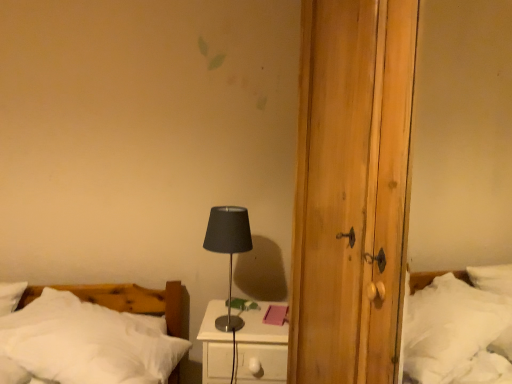
Question: Does white soft bed at lower left appear on the right side of white glossy nightstand at center?

Choices:
 (A) yes
 (B) no

Answer: (B)

Question: From the image's perspective, is white soft bed at lower left below white glossy nightstand at center?

Choices:
 (A) no
 (B) yes

Answer: (A)

Question: Is white soft bed at lower left directly adjacent to white glossy nightstand at center?

Choices:
 (A) yes
 (B) no

Answer: (B)

Question: Can you confirm if white soft bed at lower left is smaller than white glossy nightstand at center?

Choices:
 (A) yes
 (B) no

Answer: (B)

Question: Is white soft bed at lower left wider than white glossy nightstand at center?

Choices:
 (A) yes
 (B) no

Answer: (A)

Question: Does white soft bed at lower left appear on the left side of white glossy nightstand at center?

Choices:
 (A) no
 (B) yes

Answer: (B)

Question: Is the depth of black metallic table lamp at center greater than that of white soft bed at lower left?

Choices:
 (A) no
 (B) yes

Answer: (B)

Question: Can you confirm if black metallic table lamp at center is positioned to the right of white soft bed at lower left?

Choices:
 (A) yes
 (B) no

Answer: (A)

Question: Does black metallic table lamp at center turn towards white soft bed at lower left?

Choices:
 (A) no
 (B) yes

Answer: (A)

Question: From the image's perspective, is black metallic table lamp at center on white soft bed at lower left?

Choices:
 (A) yes
 (B) no

Answer: (A)

Question: Considering the relative sizes of black metallic table lamp at center and white soft bed at lower left in the image provided, is black metallic table lamp at center smaller than white soft bed at lower left?

Choices:
 (A) no
 (B) yes

Answer: (B)

Question: From a real-world perspective, is black metallic table lamp at center over white soft bed at lower left?

Choices:
 (A) yes
 (B) no

Answer: (A)

Question: Is white glossy nightstand at center at the right side of black metallic table lamp at center?

Choices:
 (A) yes
 (B) no

Answer: (A)